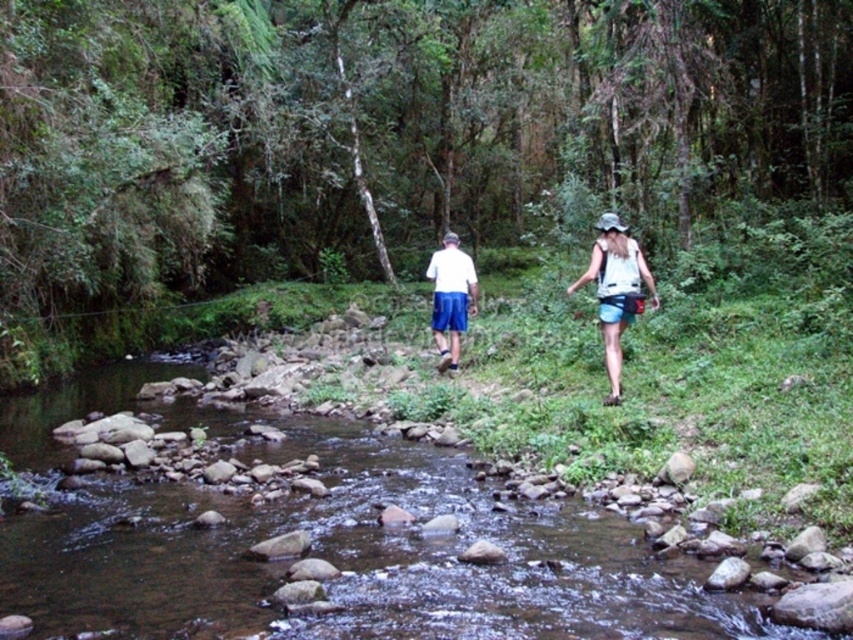
You are planning to wash these two clothes in a washing machine. Given that the white cotton shirt at center and the white cotton tank top at center are both made of cotton, which one is more likely to require a longer washing cycle to ensure thorough cleaning?

The white cotton tank top at center is thicker than the white cotton shirt at center, so it may require a longer washing cycle to ensure thorough cleaning.

You are a hiker planning to cross the stream. You see the clear water at stream center and the white matte shorts at center. Which one has a larger area in the image?

The clear water at stream center is bigger than the white matte shorts at center, so the clear water at stream center has a larger area in the image.